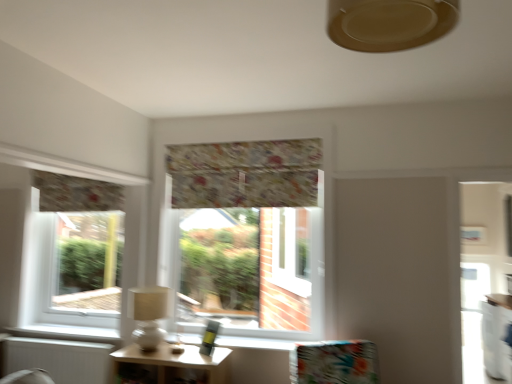
What do you see at coordinates (170, 365) in the screenshot?
I see `wooden table at lower center` at bounding box center [170, 365].

The height and width of the screenshot is (384, 512). Describe the element at coordinates (76, 193) in the screenshot. I see `floral fabric curtain at left, marked as the 1th curtain in a back-to-front arrangement` at that location.

Image resolution: width=512 pixels, height=384 pixels. What do you see at coordinates (245, 174) in the screenshot?
I see `floral fabric curtain at center, placed as the first curtain when sorted from right to left` at bounding box center [245, 174].

This screenshot has height=384, width=512. What do you see at coordinates (246, 229) in the screenshot? I see `floral fabric valance at center, the second window positioned from the left` at bounding box center [246, 229].

The width and height of the screenshot is (512, 384). Describe the element at coordinates (59, 359) in the screenshot. I see `white matte radiator at lower left` at that location.

What are the coordinates of `wooden table at lower center` in the screenshot? It's located at (170, 365).

Is point (411, 24) less distant than point (202, 205)?

Yes.

Is beige matte ceiling fan at upper center next to floral fabric curtain at center, the 2th curtain in the left-to-right sequence?

They are not placed beside each other.

This screenshot has height=384, width=512. I want to click on curtain that is the 1st one when counting leftward from the beige matte ceiling fan at upper center, so click(245, 174).

Can you confirm if beige matte ceiling fan at upper center is thinner than floral fabric curtain at center, arranged as the 2th curtain when viewed from the back?

No.

Considering the positions of objects transparent plastic screen door at right and wooden table at lower center in the image provided, who is more to the left, transparent plastic screen door at right or wooden table at lower center?

Positioned to the left is wooden table at lower center.

Where is `table in front of the transparent plastic screen door at right`? table in front of the transparent plastic screen door at right is located at coordinates click(170, 365).

From the image's perspective, between transparent plastic screen door at right and wooden table at lower center, which one is located above?

wooden table at lower center, from the image's perspective.

Considering the relative sizes of transparent plastic screen door at right and wooden table at lower center in the image provided, is transparent plastic screen door at right taller than wooden table at lower center?

Correct, transparent plastic screen door at right is much taller as wooden table at lower center.

Could you tell me if transparent glass window at left, the second window positioned from the right, is turned towards floral fabric valance at center, which is the first window in right-to-left order?

No, transparent glass window at left, the second window positioned from the right, is not oriented towards floral fabric valance at center, which is the first window in right-to-left order.

How different are the orientations of transparent glass window at left, the second window positioned from the right, and floral fabric valance at center, which is the first window in right-to-left order, in degrees?

0.000556 degrees.

I want to click on window behind the floral fabric valance at center, the second window positioned from the left, so click(69, 250).

Considering the sizes of objects transparent glass window at left, the 1th window in the left-to-right sequence, and floral fabric valance at center, the second window positioned from the left, in the image provided, who is wider, transparent glass window at left, the 1th window in the left-to-right sequence, or floral fabric valance at center, the second window positioned from the left,?

Wider between the two is transparent glass window at left, the 1th window in the left-to-right sequence.

Can you confirm if wooden table at lower center is bigger than floral fabric curtain at left, which is the first curtain in left-to-right order?

Yes.

Considering the points (123, 379) and (89, 207), which point is behind, point (123, 379) or point (89, 207)?

The point (89, 207) is more distant.

Can you confirm if wooden table at lower center is positioned to the right of floral fabric curtain at left, which is the first curtain in left-to-right order?

Correct, you'll find wooden table at lower center to the right of floral fabric curtain at left, which is the first curtain in left-to-right order.

Are wooden table at lower center and floral fabric curtain at left, which is the second curtain from right to left, making contact?

No, wooden table at lower center is not in contact with floral fabric curtain at left, which is the second curtain from right to left.

Where is `window that is the 2nd one above the white matte radiator at lower left (from a real-world perspective)`? This screenshot has height=384, width=512. window that is the 2nd one above the white matte radiator at lower left (from a real-world perspective) is located at coordinates (246, 229).

Which of these two, floral fabric valance at center, the second window positioned from the left, or white matte radiator at lower left, is smaller?

white matte radiator at lower left is smaller.

Is floral fabric valance at center, the second window positioned from the left, positioned before white matte radiator at lower left?

That is True.

Is floral fabric valance at center, the second window positioned from the left, spatially inside white matte radiator at lower left, or outside of it?

floral fabric valance at center, the second window positioned from the left, cannot be found inside white matte radiator at lower left.

From a real-world perspective, is beige fabric lampshade at left below floral fabric curtain at left, which is the first curtain in left-to-right order?

Correct, in the physical world, beige fabric lampshade at left is lower than floral fabric curtain at left, which is the first curtain in left-to-right order.

What's the angular difference between beige fabric lampshade at left and floral fabric curtain at left, which is the second curtain from right to left,'s facing directions?

beige fabric lampshade at left and floral fabric curtain at left, which is the second curtain from right to left, are facing 1.42 degrees away from each other.

From the image's perspective, is beige fabric lampshade at left located beneath floral fabric curtain at left, which appears as the second curtain when viewed from the front?

Yes, from the image's perspective, beige fabric lampshade at left is below floral fabric curtain at left, which appears as the second curtain when viewed from the front.

Does point (137, 256) come farther from viewer compared to point (118, 371)?

Yes, it is.

Which object is further away from the camera, transparent glass window at left, the 1th window in the left-to-right sequence, or wooden table at lower center?

transparent glass window at left, the 1th window in the left-to-right sequence.

Identify the location of table in front of the transparent glass window at left, the second window positioned from the right. The height and width of the screenshot is (384, 512). (170, 365).

Which curtain is the 1st one when counting from the back of the beige matte ceiling fan at upper center? Please provide its 2D coordinates.

[(245, 174)]

Image resolution: width=512 pixels, height=384 pixels. What are the coordinates of `screen door above the wooden table at lower center (from a real-world perspective)` in the screenshot? It's located at (473, 320).

From the image, which object appears to be nearer to white matte radiator at lower left, floral fabric cushion at center or white glossy counter at lower right?

floral fabric cushion at center.

Which object lies nearer to the anchor point wooden table at lower center, beige fabric lampshade at left or floral fabric curtain at left, which is the first curtain in left-to-right order?

beige fabric lampshade at left.

Which object lies further to the anchor point floral fabric valance at center, which is the first window in right-to-left order, floral fabric curtain at left, marked as the 1th curtain in a back-to-front arrangement, or floral fabric cushion at center?

Based on the image, floral fabric curtain at left, marked as the 1th curtain in a back-to-front arrangement, appears to be further to floral fabric valance at center, which is the first window in right-to-left order.

When comparing their distances from floral fabric cushion at center, does white glossy counter at lower right or transparent glass window at left, the second window positioned from the right, seem closer?

Among the two, white glossy counter at lower right is located nearer to floral fabric cushion at center.

In the scene shown: From the image, which object appears to be nearer to white matte radiator at lower left, beige fabric lampshade at left or floral fabric curtain at center, placed as the first curtain when sorted from right to left?

beige fabric lampshade at left is closer to white matte radiator at lower left.

From the image, which object appears to be nearer to beige fabric lampshade at left, transparent plastic screen door at right or white matte radiator at lower left?

The object closer to beige fabric lampshade at left is white matte radiator at lower left.

Considering their positions, is floral fabric cushion at center positioned further to beige matte ceiling fan at upper center than transparent plastic screen door at right?

transparent plastic screen door at right is further to beige matte ceiling fan at upper center.

Based on their spatial positions, is transparent plastic screen door at right or white matte radiator at lower left closer to floral fabric cushion at center?

transparent plastic screen door at right is positioned closer to the anchor floral fabric cushion at center.

Where is `table located between transparent glass window at left, the 1th window in the left-to-right sequence, and floral fabric cushion at center in the left-right direction`? The width and height of the screenshot is (512, 384). table located between transparent glass window at left, the 1th window in the left-to-right sequence, and floral fabric cushion at center in the left-right direction is located at coordinates (170, 365).

You are a GUI agent. You are given a task and a screenshot of the screen. Output one action in this format:
    pyautogui.click(x=<x>, y=<y>)
    Task: Click on the lamp between floral fabric curtain at center, marked as the 1th curtain in a front-to-back arrangement, and white matte radiator at lower left from top to bottom
    The height and width of the screenshot is (384, 512).
    Given the screenshot: What is the action you would take?
    pyautogui.click(x=149, y=316)

The width and height of the screenshot is (512, 384). Identify the location of radiator located between beige matte ceiling fan at upper center and transparent plastic screen door at right in the depth direction. (59, 359).

Find the location of a particular element. The image size is (512, 384). radiator between beige matte ceiling fan at upper center and transparent glass window at left, the 1th window in the left-to-right sequence, in the front-back direction is located at coordinates (59, 359).